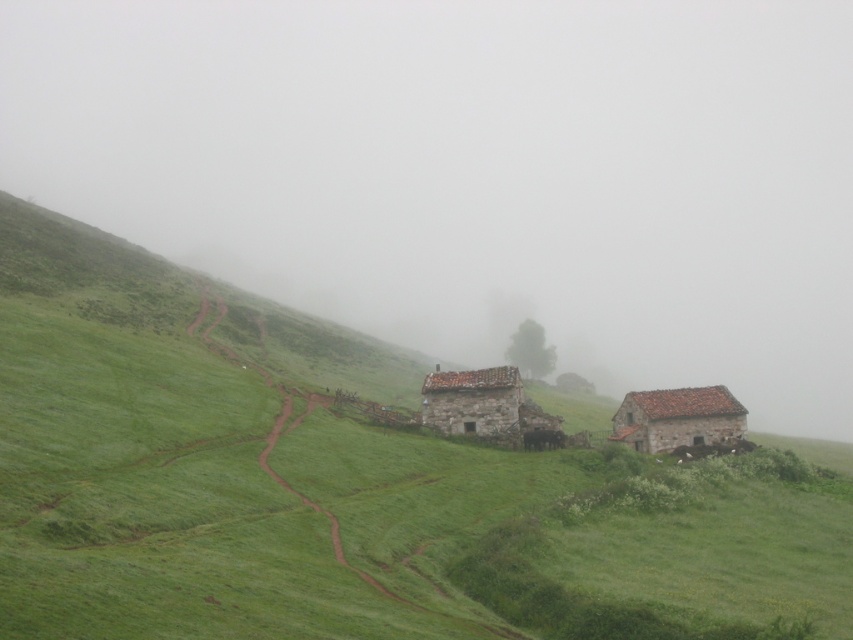
Question: Which point is closer to the camera taking this photo?

Choices:
 (A) (779, 196)
 (B) (351, 337)
 (C) (457, 424)

Answer: (C)

Question: Which of the following is the farthest from the observer?

Choices:
 (A) brown stone hut at lower right
 (B) rustic stone hut at center
 (C) foggy mist at center
 (D) green grassy at lower left

Answer: (C)

Question: Estimate the real-world distances between objects in this image. Which object is closer to the rustic stone hut at center?

Choices:
 (A) foggy mist at center
 (B) brown stone hut at lower right
 (C) green grassy at lower left

Answer: (B)

Question: Is foggy mist at center positioned before rustic stone hut at center?

Choices:
 (A) no
 (B) yes

Answer: (A)

Question: Is brown stone hut at lower right smaller than rustic stone hut at center?

Choices:
 (A) no
 (B) yes

Answer: (A)

Question: Is foggy mist at center below green grassy at lower left?

Choices:
 (A) yes
 (B) no

Answer: (B)